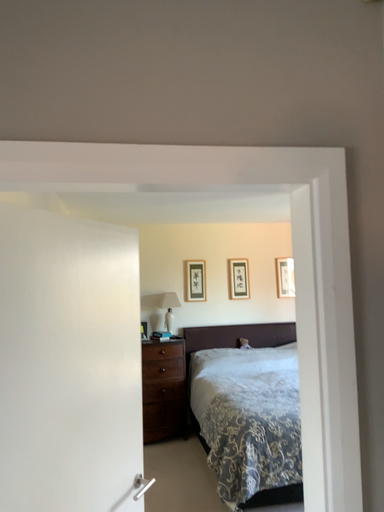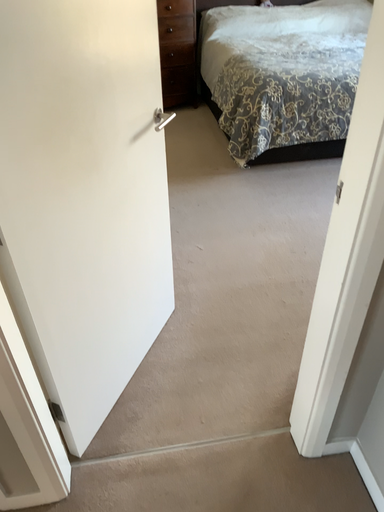
Question: Which way did the camera rotate in the video?

Choices:
 (A) rotated upward
 (B) rotated downward

Answer: (B)